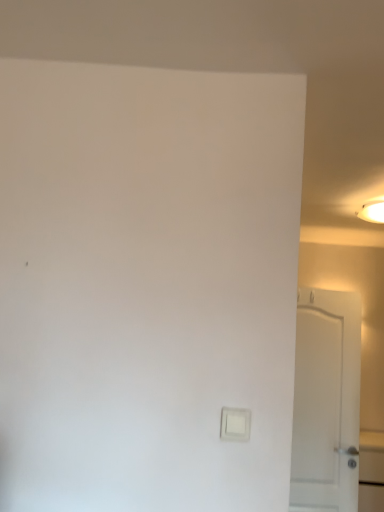
Question: Considering the positions of white plastic light switch at lower center and white glossy light fixture at upper right in the image, is white plastic light switch at lower center wider or thinner than white glossy light fixture at upper right?

Choices:
 (A) thin
 (B) wide

Answer: (A)

Question: Choose the correct answer: Is white plastic light switch at lower center inside white glossy light fixture at upper right or outside it?

Choices:
 (A) outside
 (B) inside

Answer: (A)

Question: Estimate the real-world distances between objects in this image. Which object is farther from the white glossy light fixture at upper right?

Choices:
 (A) white matte door at right
 (B) white plastic light switch at lower center

Answer: (B)

Question: Estimate the real-world distances between objects in this image. Which object is closer to the white glossy light fixture at upper right?

Choices:
 (A) white matte door at right
 (B) white plastic light switch at lower center

Answer: (A)